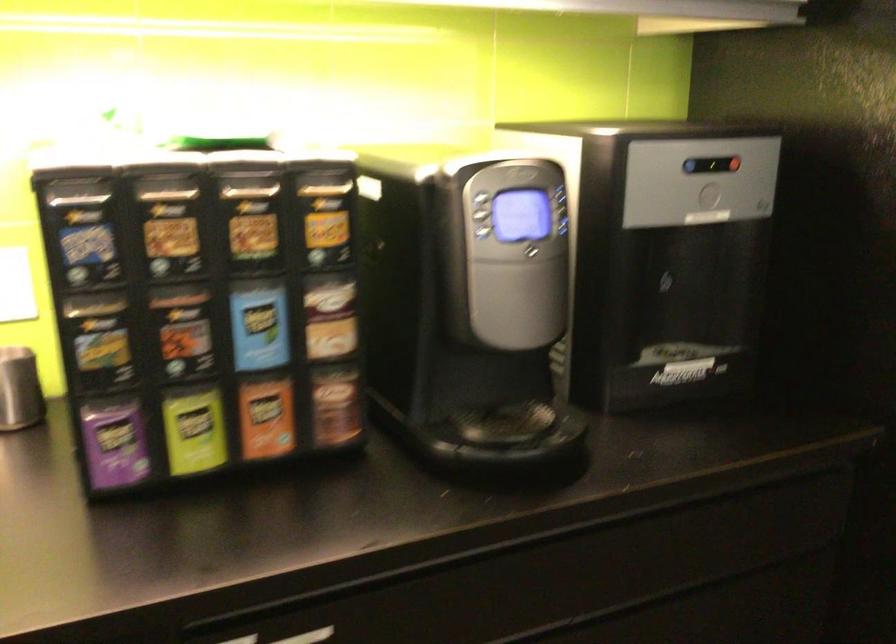
What do you see at coordinates (691, 166) in the screenshot? I see `a blue dispenser button` at bounding box center [691, 166].